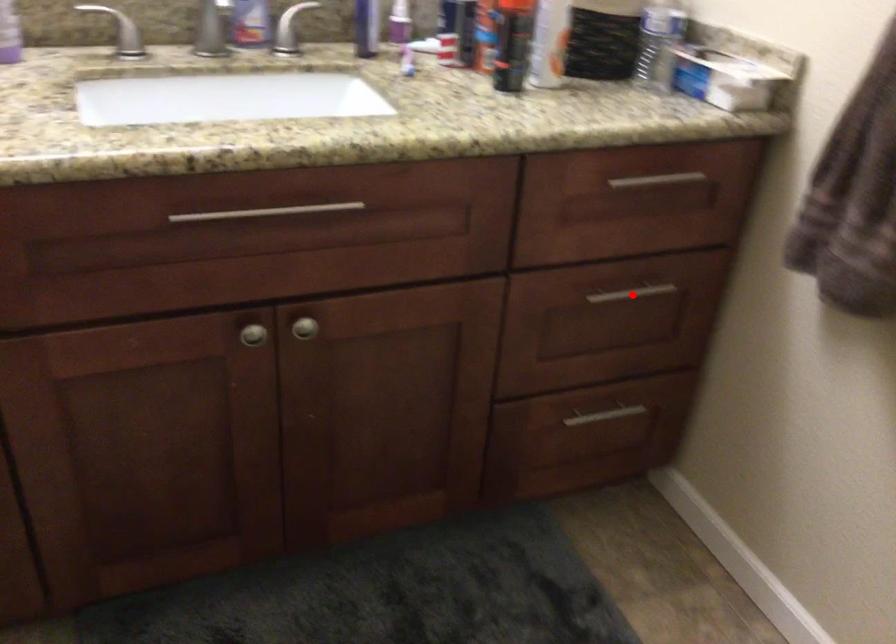
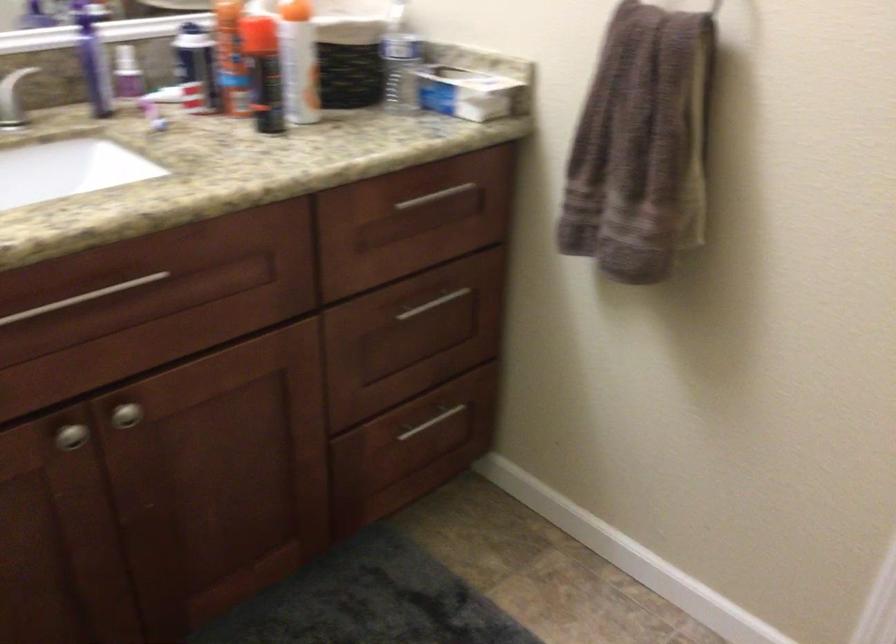
Where in the second image is the point corresponding to the highlighted location from the first image?

(434, 304)